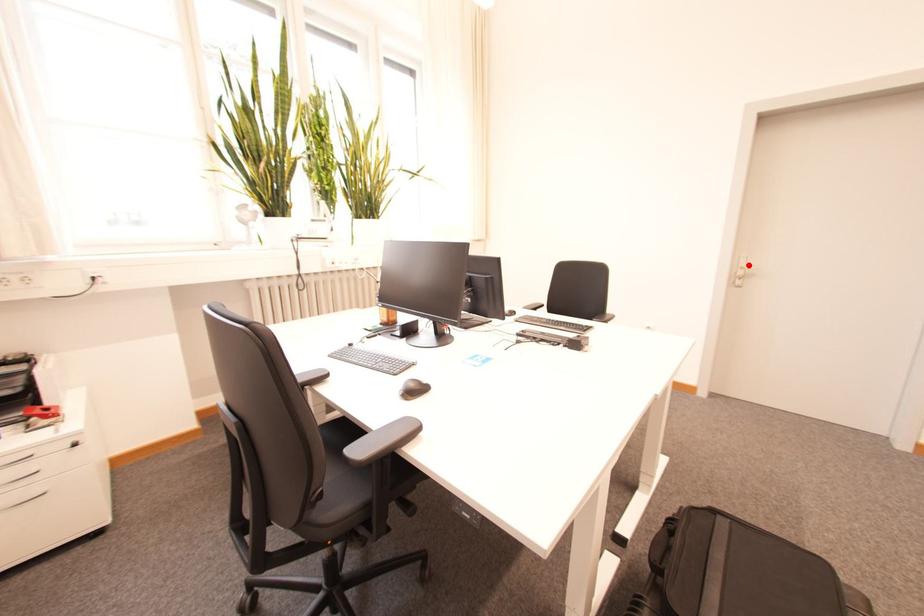
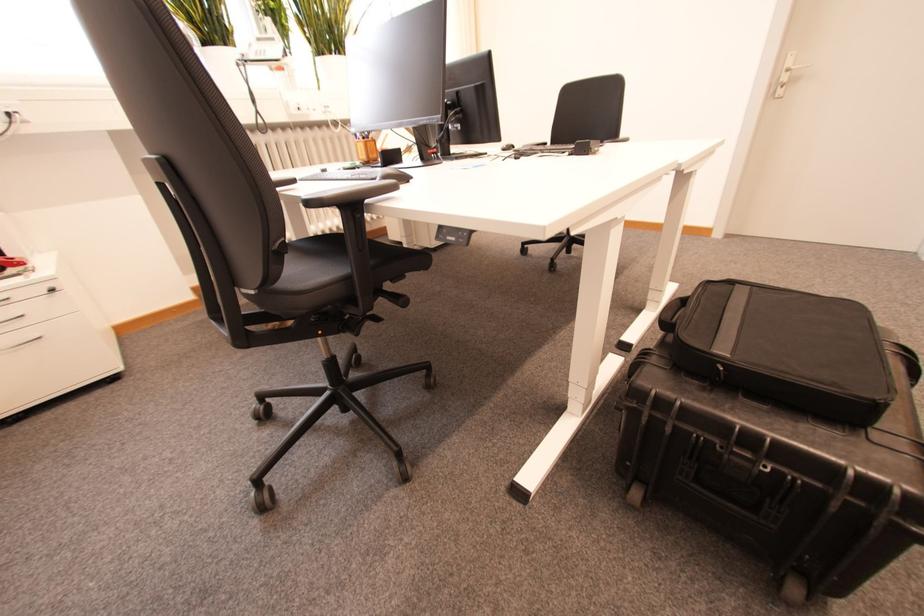
Locate, in the second image, the point that corresponds to the highlighted location in the first image.

(796, 65)